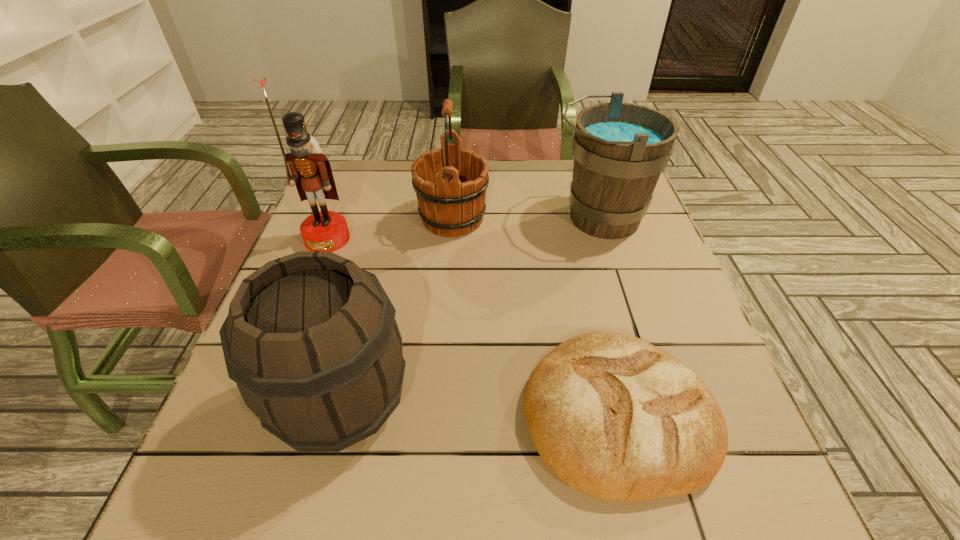
The height and width of the screenshot is (540, 960). Identify the location of wine bucket located at the near edge. (311, 340).

This screenshot has height=540, width=960. Identify the location of bread that is at the near edge. (614, 417).

This screenshot has height=540, width=960. Find the location of `nutcracker located in the left edge section of the desktop`. nutcracker located in the left edge section of the desktop is located at coordinates (311, 172).

Where is `wine bucket at the left edge`? This screenshot has height=540, width=960. wine bucket at the left edge is located at coordinates (311, 340).

Identify the location of wine bucket present at the right edge. (620, 149).

Identify the location of bread that is at the right edge. (614, 417).

At what (x,y) coordinates should I click in order to perform the action: click on object that is at the near left corner. Please return your answer as a coordinate pair (x, y). Looking at the image, I should click on (311, 340).

What are the coordinates of `object that is at the far right corner` in the screenshot? It's located at (620, 149).

Identify the location of object present at the near right corner. The width and height of the screenshot is (960, 540). (614, 417).

This screenshot has height=540, width=960. Find the location of `vacant space at the far edge of the desktop`. vacant space at the far edge of the desktop is located at coordinates (491, 176).